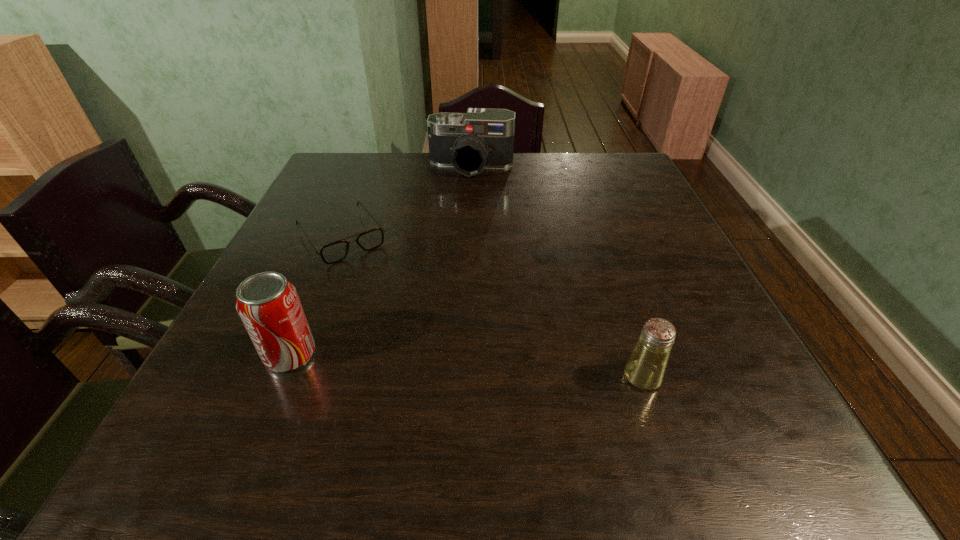
The width and height of the screenshot is (960, 540). In order to click on free space between the rightmost object and the shortest object in this screenshot , I will do (492, 307).

Locate an element on the screen. The image size is (960, 540). vacant space in between the second object from right to left and the sunglasses is located at coordinates (407, 202).

The width and height of the screenshot is (960, 540). I want to click on vacant space that's between the second object from right to left and the sunglasses, so click(407, 202).

Identify the location of vacant point located between the soda can and the camera. The width and height of the screenshot is (960, 540). (381, 261).

Identify the location of unoccupied position between the second farthest object and the rightmost object. (492, 307).

You are a GUI agent. You are given a task and a screenshot of the screen. Output one action in this format:
    pyautogui.click(x=<x>, y=<y>)
    Task: Click on the free space between the soda can and the sunglasses
    The height and width of the screenshot is (540, 960).
    Given the screenshot: What is the action you would take?
    pyautogui.click(x=316, y=296)

Where is `unoccupied position between the third nearest object and the camera`? This screenshot has width=960, height=540. unoccupied position between the third nearest object and the camera is located at coordinates (407, 202).

Point out which object is positioned as the third nearest to the soda can. Please provide its 2D coordinates. Your answer should be formatted as a tuple, i.e. [(x, y)], where the tuple contains the x and y coordinates of a point satisfying the conditions above.

[(481, 138)]

Locate an element on the screen. The width and height of the screenshot is (960, 540). object that is the closest to the third object from left to right is located at coordinates (337, 251).

The width and height of the screenshot is (960, 540). Find the location of `vacant space that satisfies the following two spatial constraints: 1. on the front side of the soda can; 2. on the right side of the third tallest object`. vacant space that satisfies the following two spatial constraints: 1. on the front side of the soda can; 2. on the right side of the third tallest object is located at coordinates (281, 377).